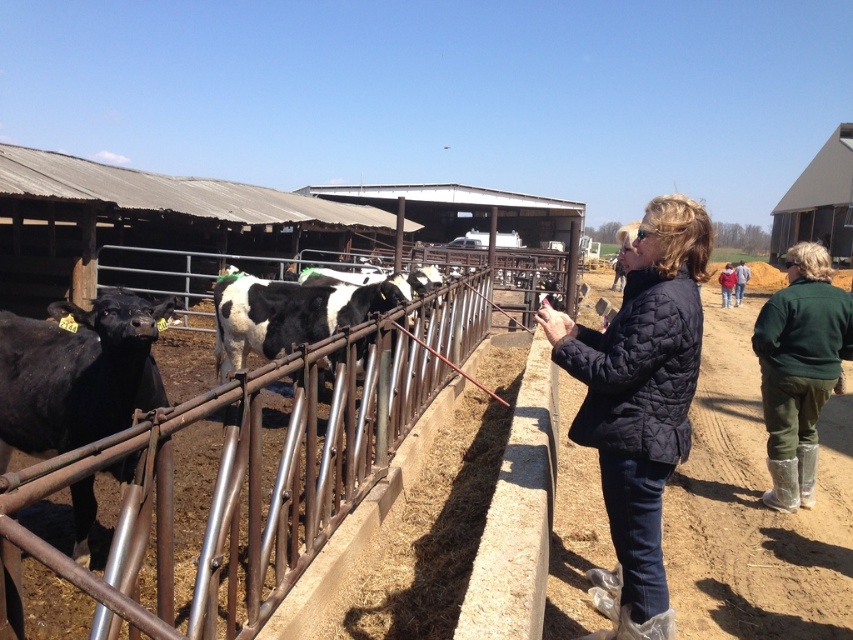
Is brushed metal fence at center wider than quilted navy jacket at center?

In fact, brushed metal fence at center might be narrower than quilted navy jacket at center.

Does brushed metal fence at center appear on the left side of quilted navy jacket at center?

Correct, you'll find brushed metal fence at center to the left of quilted navy jacket at center.

Is point (221, 556) closer to viewer compared to point (602, 394)?

That is True.

Find the location of a particular element. The height and width of the screenshot is (640, 853). brushed metal fence at center is located at coordinates (254, 470).

Is black smooth cow at left wider than green fabric jacket at center?

In fact, black smooth cow at left might be narrower than green fabric jacket at center.

Who is higher up, black smooth cow at left or green fabric jacket at center?

Positioned higher is green fabric jacket at center.

Which is behind, point (126, 480) or point (735, 301)?

The point (735, 301) is behind.

This screenshot has height=640, width=853. Find the location of `black smooth cow at left`. black smooth cow at left is located at coordinates (76, 372).

Measure the distance between black and white spotted cow at center and green fabric jacket at center.

66.17 feet

Which is in front, point (361, 305) or point (747, 269)?

Point (361, 305)

Find the location of a particular element. The height and width of the screenshot is (640, 853). black and white spotted cow at center is located at coordinates (291, 314).